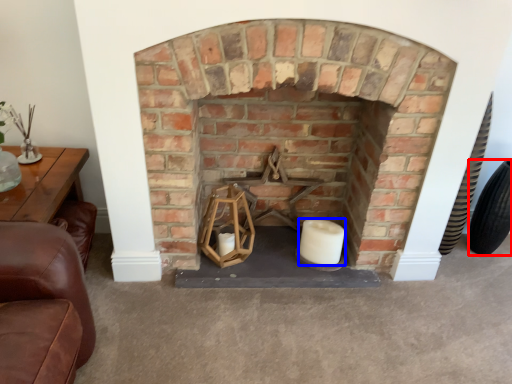
Question: Which point is closer to the camera, tire (highlighted by a red box) or candle (highlighted by a blue box)?

Choices:
 (A) tire
 (B) candle

Answer: (B)